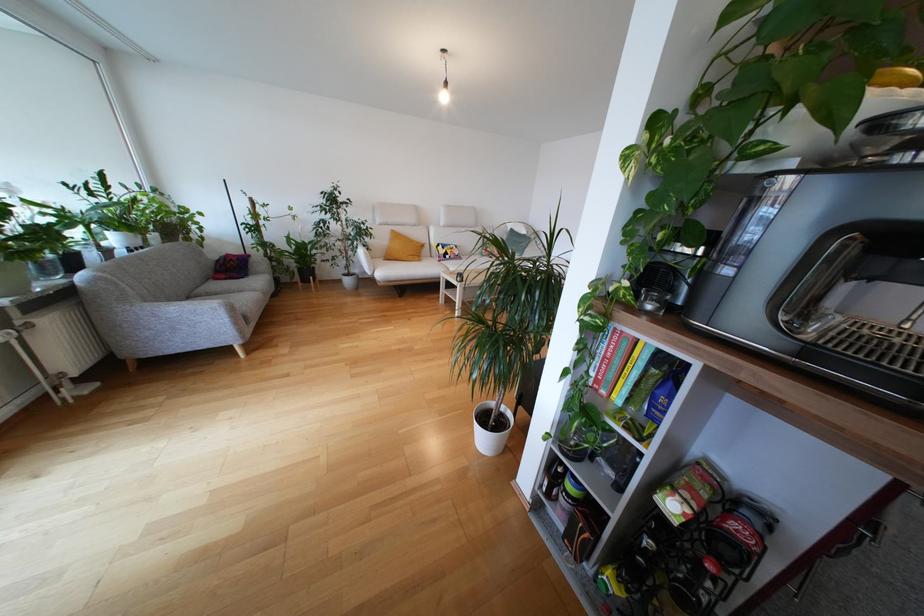
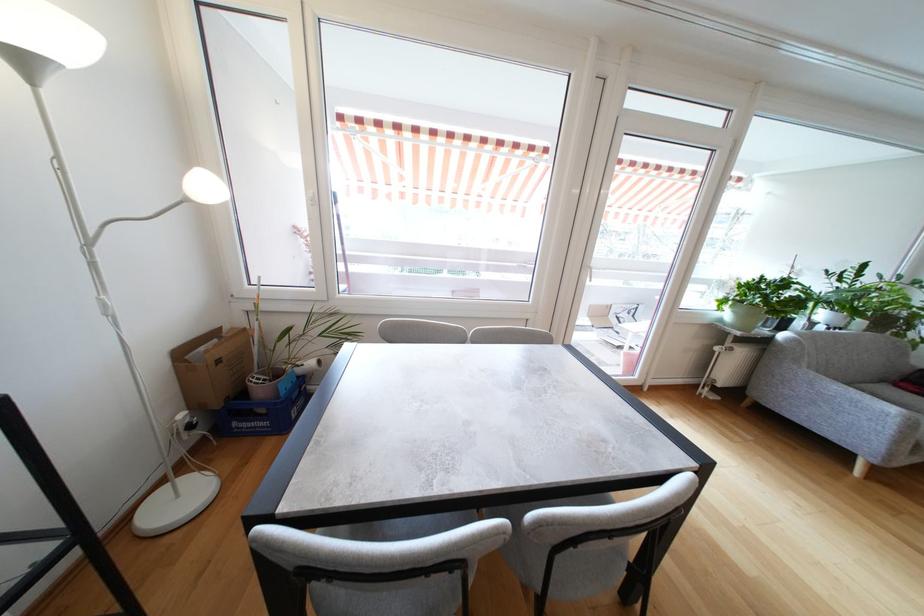
In the second image, find the point that corresponds to pixel 134 252 in the first image.

(833, 330)